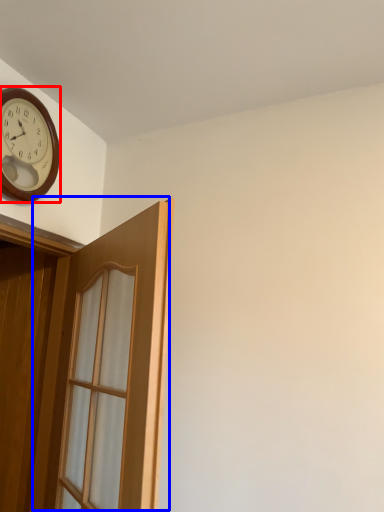
Question: Among these objects, which one is farthest to the camera, clock (highlighted by a red box) or door (highlighted by a blue box)?

Choices:
 (A) clock
 (B) door

Answer: (A)